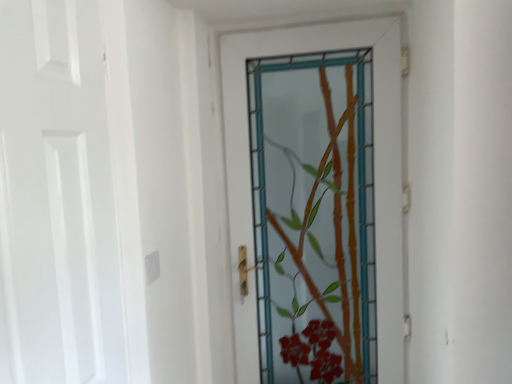
Question: From a real-world perspective, is translucent glass bamboo at center, the second door positioned from the left, below white matte door at left, the 2th door from the back?

Choices:
 (A) no
 (B) yes

Answer: (B)

Question: Is white matte door at left, the 2th door from the back, a part of translucent glass bamboo at center, which appears as the 1th door when viewed from the back?

Choices:
 (A) yes
 (B) no

Answer: (B)

Question: From the image's perspective, is translucent glass bamboo at center, which appears as the 1th door when viewed from the back, located beneath white matte door at left, the 1th door viewed from the left?

Choices:
 (A) no
 (B) yes

Answer: (B)

Question: Are translucent glass bamboo at center, placed as the 1th door when sorted from right to left, and white matte door at left, the 1th door viewed from the left, located far from each other?

Choices:
 (A) yes
 (B) no

Answer: (B)

Question: Is translucent glass bamboo at center, acting as the 2th door starting from the front, positioned beyond the bounds of white matte door at left, the 1th door viewed from the left?

Choices:
 (A) no
 (B) yes

Answer: (B)

Question: Does translucent glass bamboo at center, the second door positioned from the left, have a lesser width compared to white matte door at left, the 1th door viewed from the left?

Choices:
 (A) yes
 (B) no

Answer: (B)

Question: Can you confirm if white matte door at left, the 2th door in the right-to-left sequence, is thinner than translucent glass bamboo at center, which appears as the 1th door when viewed from the back?

Choices:
 (A) yes
 (B) no

Answer: (A)

Question: Is white matte door at left, the 2th door in the right-to-left sequence, positioned before translucent glass bamboo at center, which appears as the 1th door when viewed from the back?

Choices:
 (A) no
 (B) yes

Answer: (B)

Question: Could you tell me if white matte door at left, which is the first door in front-to-back order, is turned towards translucent glass bamboo at center, the second door positioned from the left?

Choices:
 (A) yes
 (B) no

Answer: (B)

Question: Is white matte door at left, the 1th door viewed from the left, turned away from translucent glass bamboo at center, placed as the 1th door when sorted from right to left?

Choices:
 (A) yes
 (B) no

Answer: (B)

Question: From the image's perspective, would you say white matte door at left, the 2th door from the back, is shown under translucent glass bamboo at center, which appears as the 1th door when viewed from the back?

Choices:
 (A) no
 (B) yes

Answer: (A)

Question: From a real-world perspective, is white matte door at left, the 2th door from the back, on top of translucent glass bamboo at center, placed as the 1th door when sorted from right to left?

Choices:
 (A) yes
 (B) no

Answer: (A)

Question: Considering the positions of translucent glass bamboo at center, acting as the 2th door starting from the front, and white matte door at left, the 2th door from the back, in the image, is translucent glass bamboo at center, acting as the 2th door starting from the front, wider or thinner than white matte door at left, the 2th door from the back,?

Choices:
 (A) wide
 (B) thin

Answer: (A)